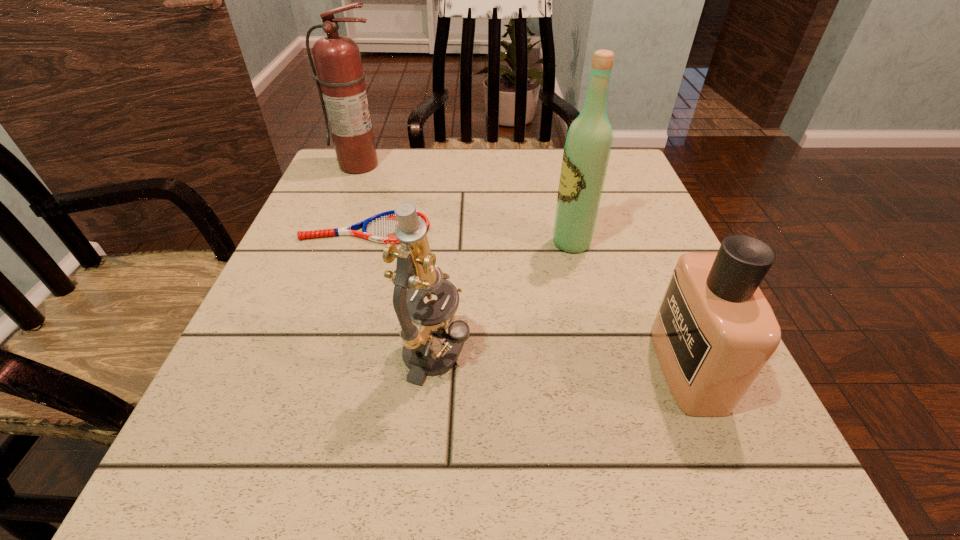
You are a GUI agent. You are given a task and a screenshot of the screen. Output one action in this format:
    pyautogui.click(x=<x>, y=<y>)
    Task: Click on the blank region between the rightmost object and the microscope
    This screenshot has height=540, width=960.
    Given the screenshot: What is the action you would take?
    pyautogui.click(x=563, y=360)

Locate an element on the screen. This screenshot has height=540, width=960. empty location between the shortest object and the rightmost object is located at coordinates (527, 298).

This screenshot has height=540, width=960. Identify the location of object that stands as the third closest to the shortest object. (588, 144).

Select which object appears as the third closest to the second shortest object. Please provide its 2D coordinates. Your answer should be formatted as a tuple, i.e. [(x, y)], where the tuple contains the x and y coordinates of a point satisfying the conditions above.

[(380, 228)]

You are a GUI agent. You are given a task and a screenshot of the screen. Output one action in this format:
    pyautogui.click(x=<x>, y=<y>)
    Task: Click on the vacant space that satisfies the following two spatial constraints: 1. on the front side of the tennis racket; 2. on the left side of the microscope
    Image resolution: width=960 pixels, height=540 pixels.
    Given the screenshot: What is the action you would take?
    pyautogui.click(x=328, y=353)

Locate an element on the screen. free space that satisfies the following two spatial constraints: 1. on the front-facing side of the tennis racket; 2. on the left side of the fire extinguisher is located at coordinates (334, 229).

This screenshot has width=960, height=540. I want to click on free space that satisfies the following two spatial constraints: 1. on the front-facing side of the farthest object; 2. on the left side of the microscope, so click(285, 353).